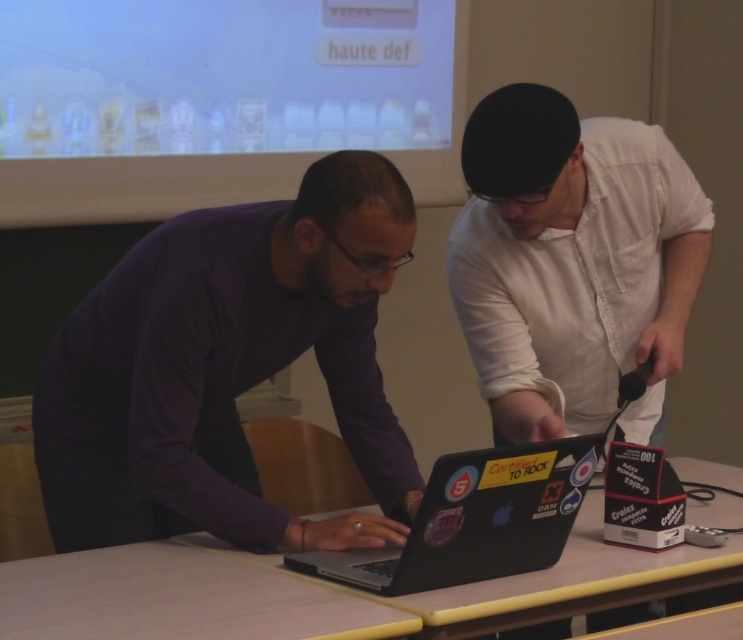
Question: Does purple matte sweater at center appear on the right side of wooden table at center?

Choices:
 (A) yes
 (B) no

Answer: (B)

Question: Which object appears farthest from the camera in this image?

Choices:
 (A) purple matte sweater at center
 (B) wooden table at center
 (C) black matte laptop at center
 (D) white matte shirt at center

Answer: (D)

Question: Which of the following is the closest to the observer?

Choices:
 (A) (590, 410)
 (B) (594, 566)
 (C) (483, 502)
 (D) (337, 390)

Answer: (C)

Question: Is white matte shirt at center wider than wooden table at center?

Choices:
 (A) yes
 (B) no

Answer: (B)

Question: Can you confirm if purple matte sweater at center is positioned below white matte shirt at center?

Choices:
 (A) no
 (B) yes

Answer: (B)

Question: Which object appears farthest from the camera in this image?

Choices:
 (A) purple matte sweater at center
 (B) wooden table at center
 (C) white matte shirt at center

Answer: (C)